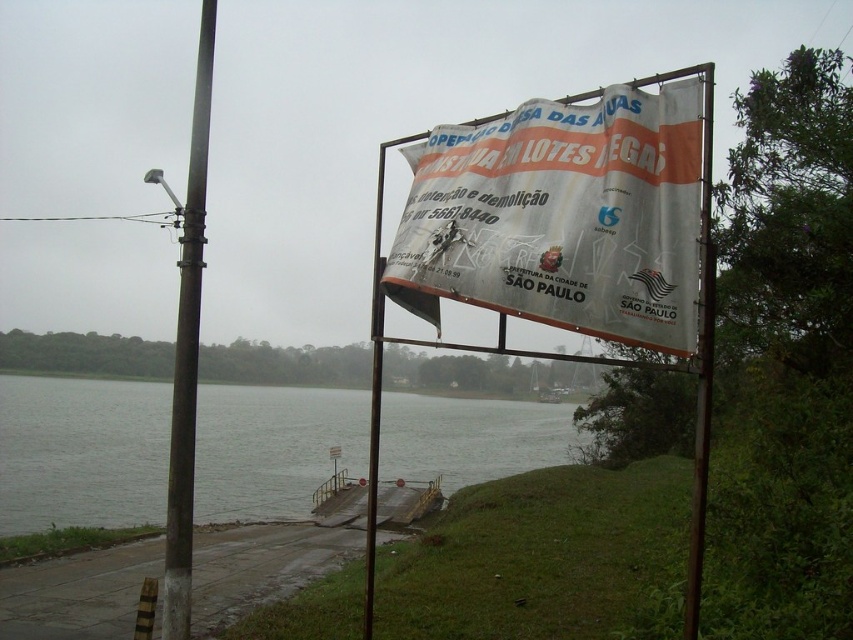
Question: Can you confirm if white plastic pole at upper center is positioned above metallic pole at center?

Choices:
 (A) no
 (B) yes

Answer: (A)

Question: Is white fabric banner at center bigger than white paper banner at center?

Choices:
 (A) no
 (B) yes

Answer: (B)

Question: Which object is positioned closest to the white fabric banner at center?

Choices:
 (A) white plastic pole at upper center
 (B) metallic pole at center
 (C) white paper banner at center
 (D) gray water at lower left

Answer: (A)

Question: Can you confirm if smooth brown pole at left is thinner than white plastic pole at upper center?

Choices:
 (A) yes
 (B) no

Answer: (B)

Question: Among these points, which one is nearest to the camera?

Choices:
 (A) (386, 394)
 (B) (619, 317)

Answer: (B)

Question: Among these points, which one is farthest from the camera?

Choices:
 (A) (335, 456)
 (B) (543, 269)
 (C) (178, 628)

Answer: (A)